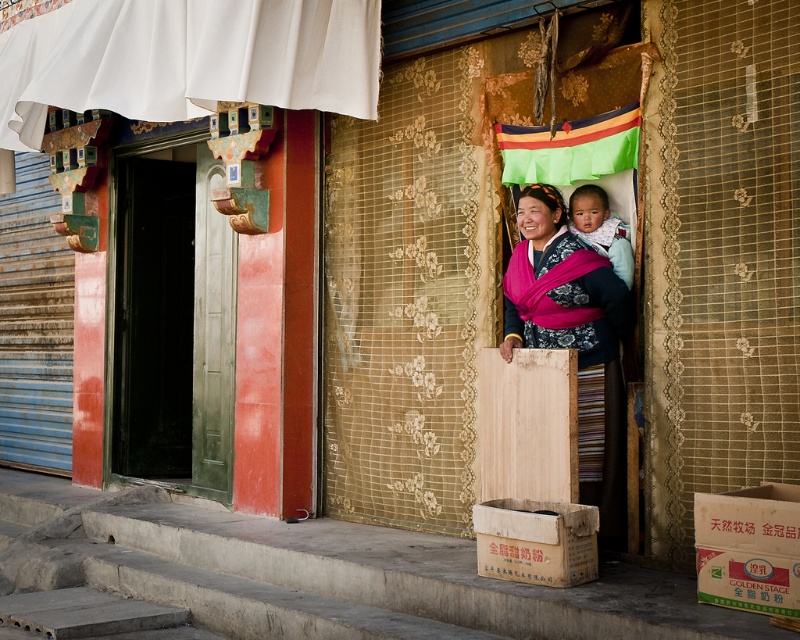
You are standing at the entrance of the building and want to know where the lace fabric curtain at center is located. Can you tell me its position in terms of coordinates?

The lace fabric curtain at center is located at coordinates point (720, 257).

What is the position of the point at coordinates (720,257) in the scene?

The point at coordinates (720,257) is located on the lace fabric curtain at center.